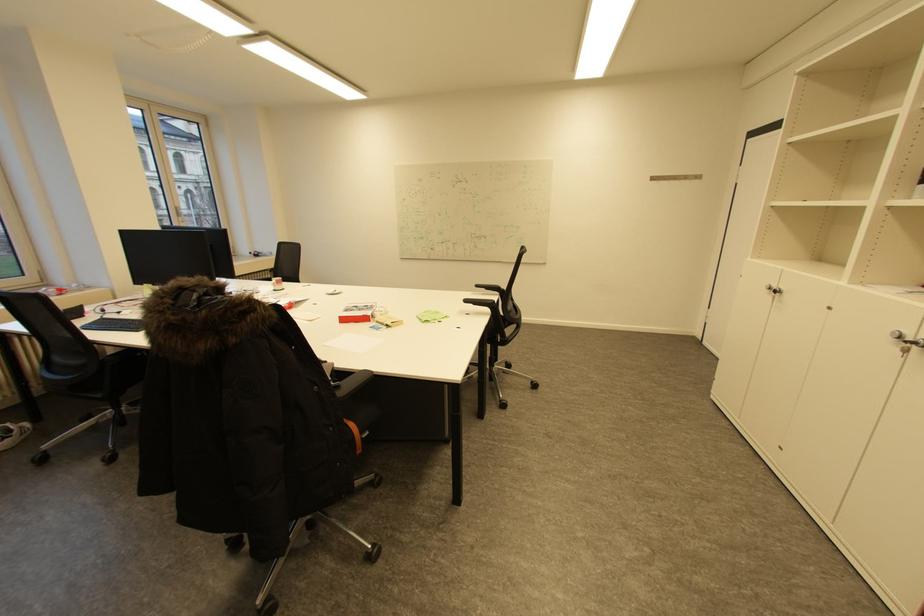
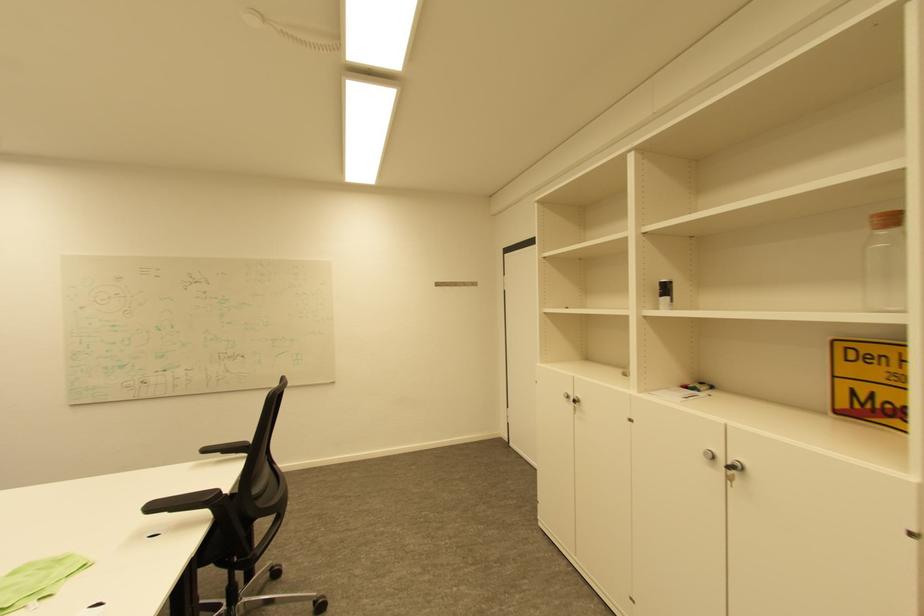
Question: The camera is either moving clockwise (left) or counter-clockwise (right) around the object. The first image is from the beginning of the video and the second image is from the end. Is the camera moving left or right when shooting the video?

Choices:
 (A) Left
 (B) Right

Answer: (A)